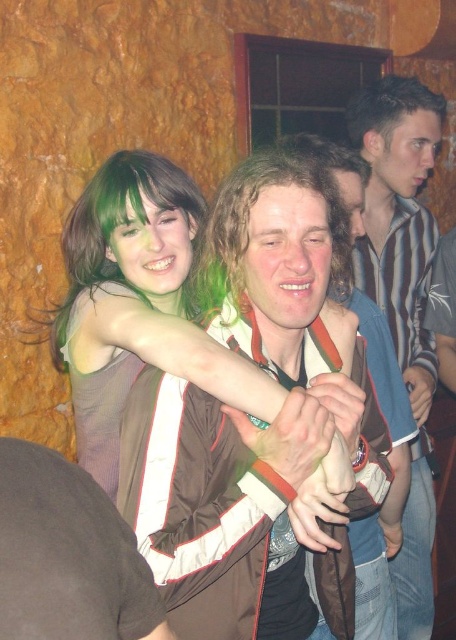
Can you confirm if matte green hair at center is smaller than green hair at upper left?

Actually, matte green hair at center might be larger than green hair at upper left.

Who is lower down, matte green hair at center or green hair at upper left?

matte green hair at center is below.

Identify the location of matte green hair at center. Image resolution: width=456 pixels, height=640 pixels. (138, 305).

Where is `matte green hair at center`? matte green hair at center is located at coordinates (138, 305).

Is green hair at upper left above smooth skin face at upper right?

Actually, green hair at upper left is below smooth skin face at upper right.

Between green hair at upper left and smooth skin face at upper right, which one is positioned higher?

smooth skin face at upper right

Between point (108, 252) and point (409, 182), which one is positioned in front?

Point (108, 252) is in front.

Locate an element on the screen. The width and height of the screenshot is (456, 640). green hair at upper left is located at coordinates (154, 248).

Can you confirm if matte brown jacket at center is positioned to the left of matte brown hair at center?

Yes, matte brown jacket at center is to the left of matte brown hair at center.

Which is more to the right, matte brown jacket at center or matte brown hair at center?

From the viewer's perspective, matte brown hair at center appears more on the right side.

Between point (305, 234) and point (335, 176), which one is positioned in front?

Point (305, 234) is in front.

The image size is (456, 640). What are the coordinates of `matte brown jacket at center` in the screenshot? It's located at (286, 257).